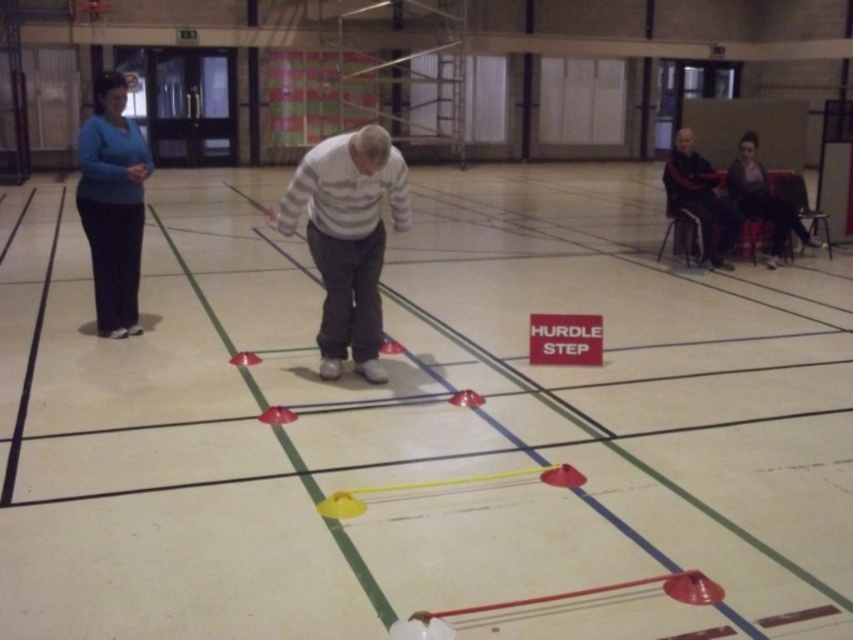
Who is shorter, white striped sweater at center or red plastic cone at center?

red plastic cone at center is shorter.

Can you confirm if white striped sweater at center is thinner than red plastic cone at center?

No.

Is point (378, 161) positioned after point (257, 417)?

Yes, point (378, 161) is farther from viewer.

Find the location of a particular element. Image resolution: width=853 pixels, height=640 pixels. white striped sweater at center is located at coordinates coord(347,237).

Between dark gray fabric jacket at upper right and red plastic cone at center, which one appears on the left side from the viewer's perspective?

red plastic cone at center

Which of these two, dark gray fabric jacket at upper right or red plastic cone at center, stands shorter?

red plastic cone at center is shorter.

Who is more forward, (683, 179) or (274, 413)?

Point (274, 413) is more forward.

Identify the location of dark gray fabric jacket at upper right. The height and width of the screenshot is (640, 853). (700, 198).

Is point (374, 157) less distant than point (114, 250)?

That is True.

Find the location of a particular element. This screenshot has height=640, width=853. white striped sweater at center is located at coordinates (347, 237).